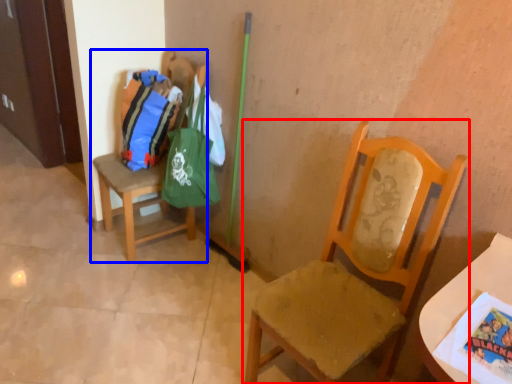
Question: Which point is further to the camera, chair (highlighted by a red box) or chair (highlighted by a blue box)?

Choices:
 (A) chair
 (B) chair

Answer: (B)